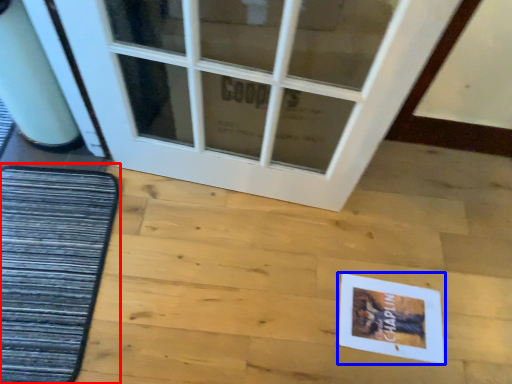
Question: Which point is closer to the camera, mat (highlighted by a red box) or postcard (highlighted by a blue box)?

Choices:
 (A) mat
 (B) postcard

Answer: (A)